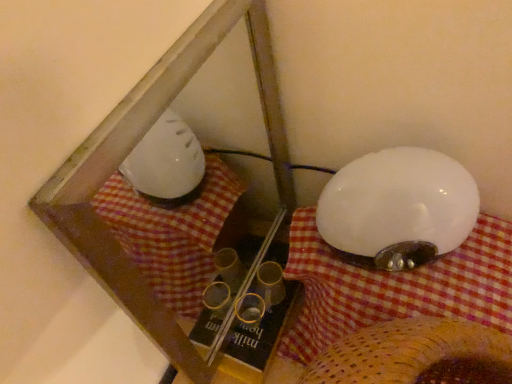
Question: Is white glossy lampshade at right to the left of white fabric at upper right from the viewer's perspective?

Choices:
 (A) yes
 (B) no

Answer: (B)

Question: From a real-world perspective, is white glossy lampshade at right on white fabric at upper right?

Choices:
 (A) yes
 (B) no

Answer: (A)

Question: Is white glossy lampshade at right turned away from white fabric at upper right?

Choices:
 (A) no
 (B) yes

Answer: (A)

Question: Considering the relative positions of white glossy lampshade at right and white fabric at upper right in the image provided, is white glossy lampshade at right in front of white fabric at upper right?

Choices:
 (A) yes
 (B) no

Answer: (B)

Question: Are white glossy lampshade at right and white fabric at upper right located far from each other?

Choices:
 (A) yes
 (B) no

Answer: (B)

Question: Is white fabric at upper right taller or shorter than transparent plastic glass box at center?

Choices:
 (A) tall
 (B) short

Answer: (B)

Question: Considering the positions of point (310, 334) and point (89, 264), is point (310, 334) closer or farther from the camera than point (89, 264)?

Choices:
 (A) farther
 (B) closer

Answer: (A)

Question: Looking at the image, does white fabric at upper right seem bigger or smaller compared to transparent plastic glass box at center?

Choices:
 (A) small
 (B) big

Answer: (B)

Question: From the image's perspective, relative to transparent plastic glass box at center, is white fabric at upper right above or below?

Choices:
 (A) below
 (B) above

Answer: (A)

Question: Is transparent plastic glass box at center spatially inside white fabric at upper right, or outside of it?

Choices:
 (A) outside
 (B) inside

Answer: (A)

Question: Is transparent plastic glass box at center wider or thinner than white fabric at upper right?

Choices:
 (A) wide
 (B) thin

Answer: (B)

Question: Is point click(x=103, y=125) positioned closer to the camera than point click(x=295, y=228)?

Choices:
 (A) farther
 (B) closer

Answer: (B)

Question: From their relative heights in the image, would you say transparent plastic glass box at center is taller or shorter than white fabric at upper right?

Choices:
 (A) tall
 (B) short

Answer: (A)

Question: Considering their positions, is transparent plastic glass box at center located in front of or behind white glossy lampshade at right?

Choices:
 (A) behind
 (B) front

Answer: (B)

Question: In terms of size, does transparent plastic glass box at center appear bigger or smaller than white glossy lampshade at right?

Choices:
 (A) small
 (B) big

Answer: (B)